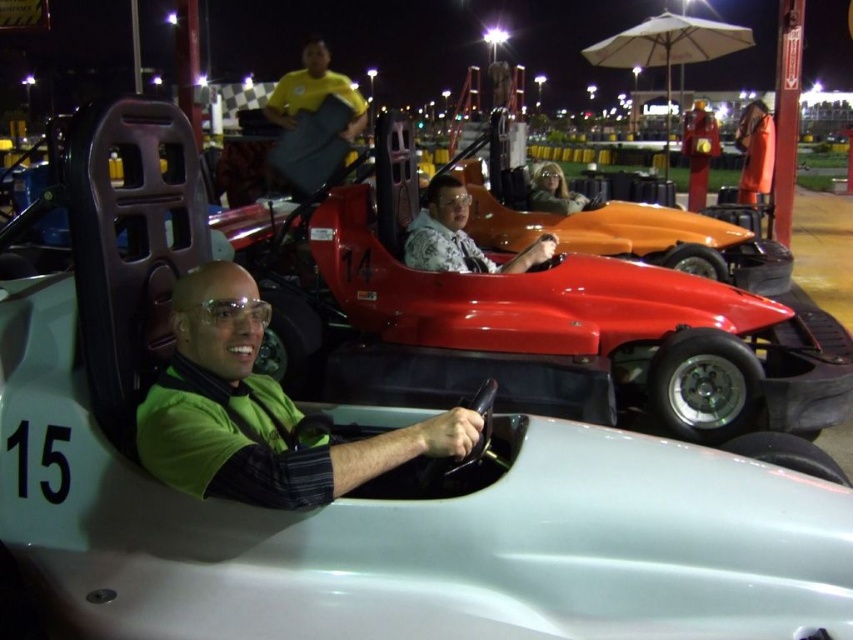
Can you confirm if green matte shirt at center is thinner than orange fabric coat at upper right?

In fact, green matte shirt at center might be wider than orange fabric coat at upper right.

Does green matte shirt at center have a greater width compared to orange fabric coat at upper right?

Yes.

Between point (288, 504) and point (749, 129), which one is positioned in front?

Point (288, 504) is in front.

The width and height of the screenshot is (853, 640). In order to click on green matte shirt at center in this screenshot , I will do `click(257, 412)`.

Does shiny red race car at center have a greater height compared to orange fabric coat at upper right?

Indeed, shiny red race car at center has a greater height compared to orange fabric coat at upper right.

This screenshot has width=853, height=640. In order to click on shiny red race car at center in this screenshot , I will do `click(552, 316)`.

Describe the element at coordinates (552, 316) in the screenshot. I see `shiny red race car at center` at that location.

Find the location of a particular element. shiny red race car at center is located at coordinates (552, 316).

You are a GUI agent. You are given a task and a screenshot of the screen. Output one action in this format:
    pyautogui.click(x=<x>, y=<y>)
    Task: Click on the shiny red race car at center
    The image size is (853, 640).
    Given the screenshot: What is the action you would take?
    pyautogui.click(x=552, y=316)

Does shiny red race car at center appear on the right side of patterned fabric shirt at center?

Indeed, shiny red race car at center is positioned on the right side of patterned fabric shirt at center.

The image size is (853, 640). Identify the location of shiny red race car at center. (552, 316).